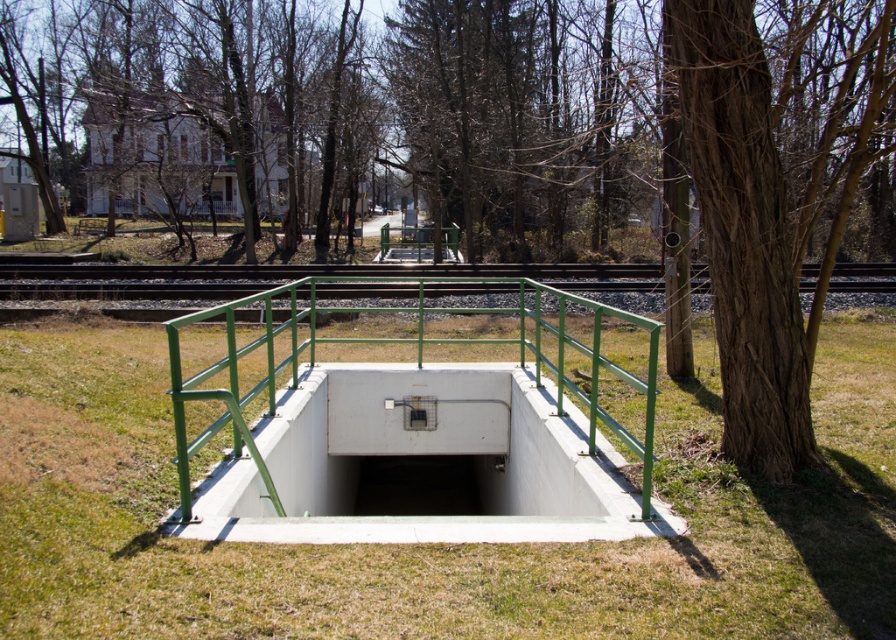
You are a gardener who needs to mow the lawn. You see the green grass at center and the white concrete rail at center. Which area requires more attention in terms of space coverage?

The green grass at center requires less attention because it occupies less space than the white concrete rail at center, which covers a larger area.

You are standing at the camera position and want to reach the green grass at center. Is the distance less than 3 meters?

The green grass at center is 2.91 meters away from camera, so yes, the distance is less than 3 meters.

You are a maintenance worker needing to cross from the green grass at center to the green metal train track at center. The safety regulations state that you must stay at least 10 meters away from the tracks for safety. Can you safely cross the area between them?

The distance between the green grass at center and the green metal train track at center is 10.30 meters, which exceeds the required 10 meters safety distance. Therefore, you can safely cross the area between them while maintaining the necessary distance from the tracks.